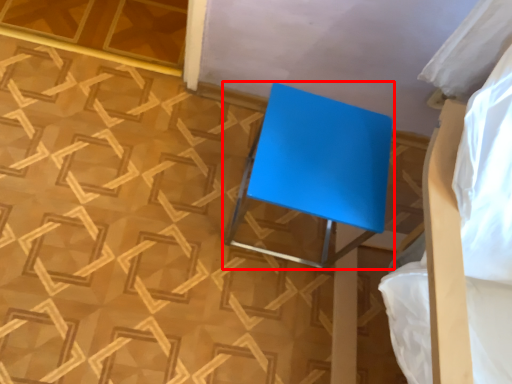
Question: From the image's perspective, what is the correct spatial positioning of furniture (annotated by the red box) in reference to bed?

Choices:
 (A) above
 (B) below

Answer: (A)